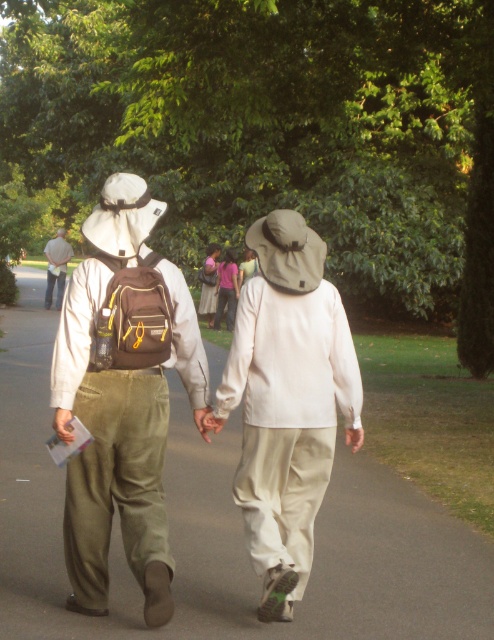
Question: Which of the following is the closest to the observer?

Choices:
 (A) smooth asphalt path at center
 (B) matte pink shirt at center

Answer: (A)

Question: Can you confirm if smooth asphalt path at center is wider than matte pink shirt at center?

Choices:
 (A) yes
 (B) no

Answer: (A)

Question: From the image, what is the correct spatial relationship of smooth asphalt path at center in relation to matte brown backpack at upper left?

Choices:
 (A) below
 (B) above

Answer: (A)

Question: Which is farther from the matte pink shirt at center?

Choices:
 (A) matte brown backpack at upper left
 (B) matte brown backpack at left
 (C) smooth asphalt path at center

Answer: (B)

Question: Observing the image, what is the correct spatial positioning of matte brown backpack at left in reference to matte pink shirt at center?

Choices:
 (A) right
 (B) left

Answer: (A)

Question: Which point appears farthest from the camera in this image?

Choices:
 (A) (217, 276)
 (B) (126, 532)

Answer: (A)